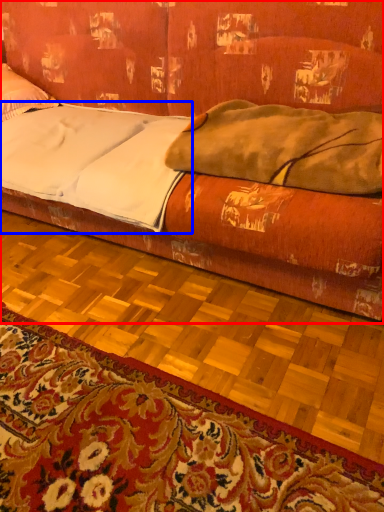
Question: Which object is closer to the camera taking this photo, studio couch (highlighted by a red box) or sheet (highlighted by a blue box)?

Choices:
 (A) studio couch
 (B) sheet

Answer: (A)